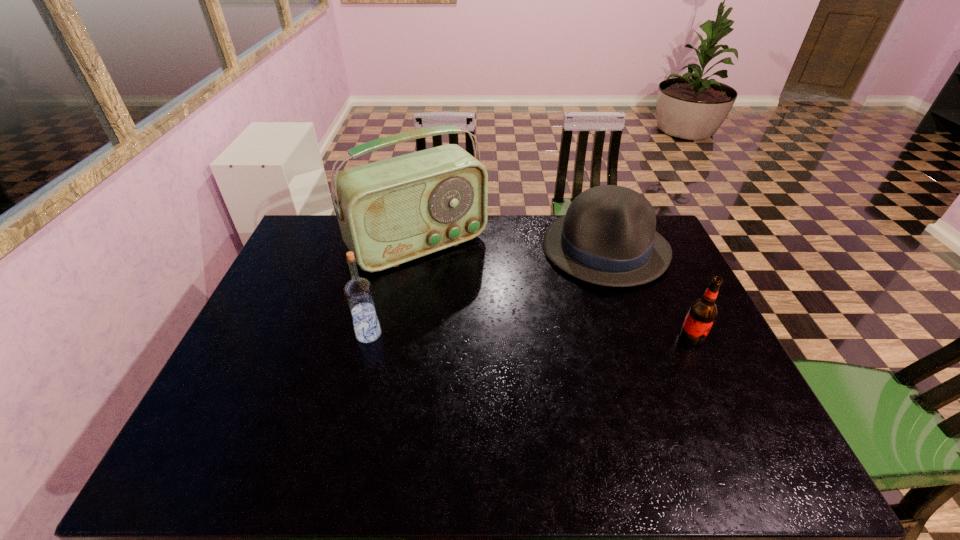
Image resolution: width=960 pixels, height=540 pixels. In order to click on free spot between the radio receiver and the root beer in this screenshot , I will do `click(555, 291)`.

Find the location of a particular element. The height and width of the screenshot is (540, 960). free point between the bowler hat and the root beer is located at coordinates (648, 293).

At what (x,y) coordinates should I click in order to perform the action: click on the second closest object to the bowler hat. Please return your answer as a coordinate pair (x, y). The width and height of the screenshot is (960, 540). Looking at the image, I should click on (392, 211).

The height and width of the screenshot is (540, 960). In order to click on object that stands as the closest to the bowler hat in this screenshot , I will do `click(702, 313)`.

Identify the location of blank space that satisfies the following two spatial constraints: 1. on the back side of the vodka; 2. on the left side of the bowler hat. (391, 248).